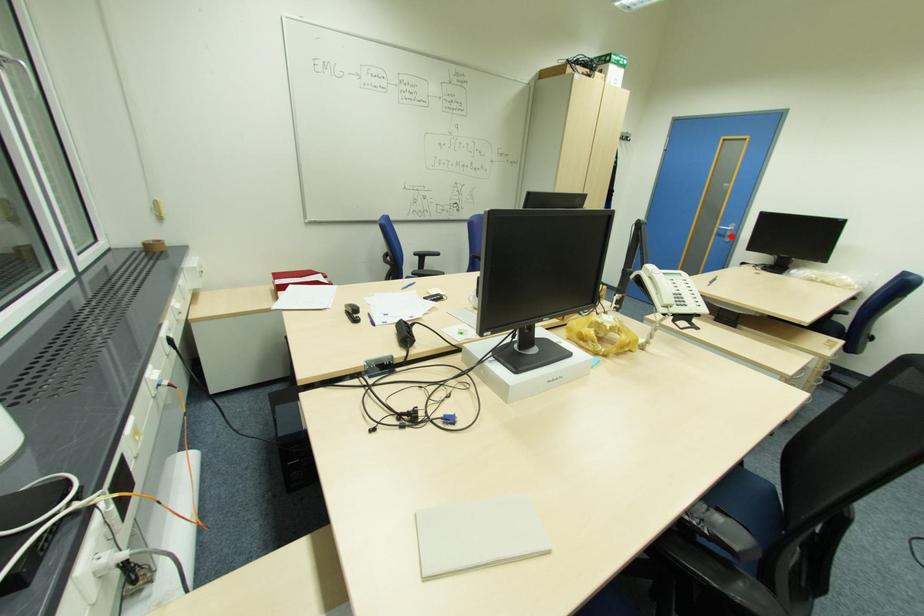
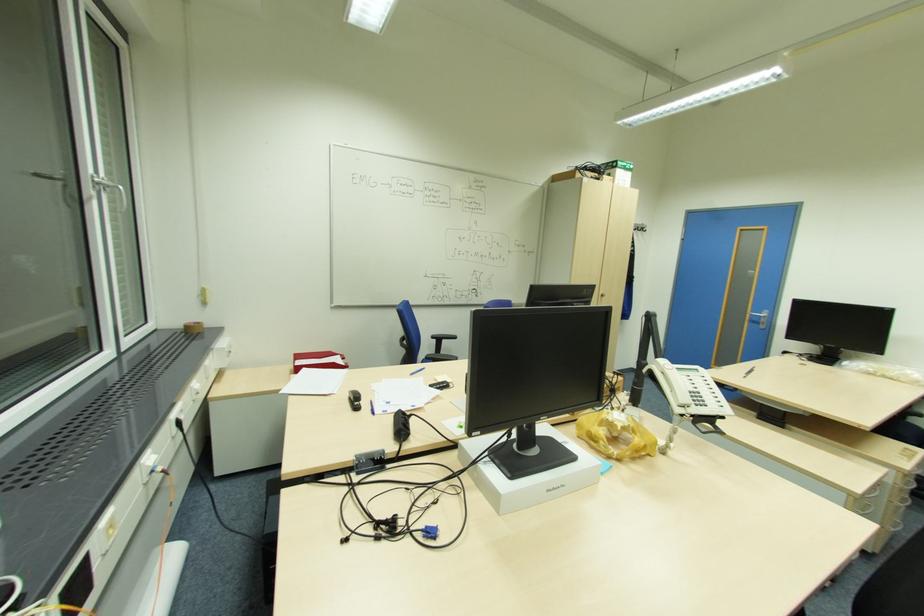
The point at the highlighted location is marked in the first image. Where is the corresponding point in the second image?

(766, 323)